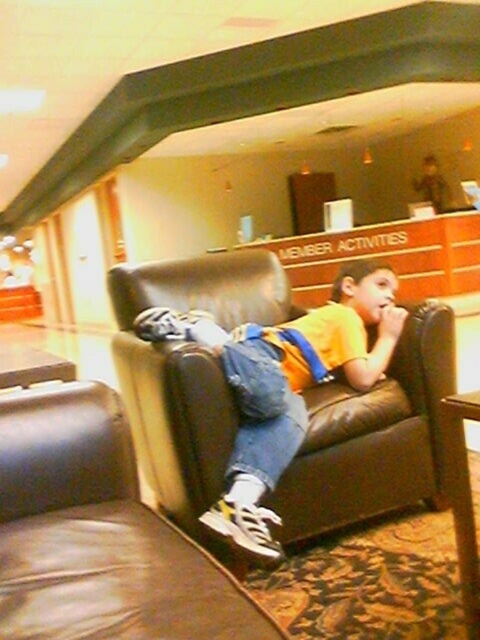
Question: Is brown leather armchair at center further to the viewer compared to matte yellow shirt at center?

Choices:
 (A) no
 (B) yes

Answer: (A)

Question: Which point is farther to the camera?

Choices:
 (A) [340, 308]
 (B) [84, 420]

Answer: (A)

Question: Is brown leather armchair at center positioned behind matte yellow shirt at center?

Choices:
 (A) yes
 (B) no

Answer: (B)

Question: Does brown leather armchair at center appear over matte yellow shirt at center?

Choices:
 (A) yes
 (B) no

Answer: (B)